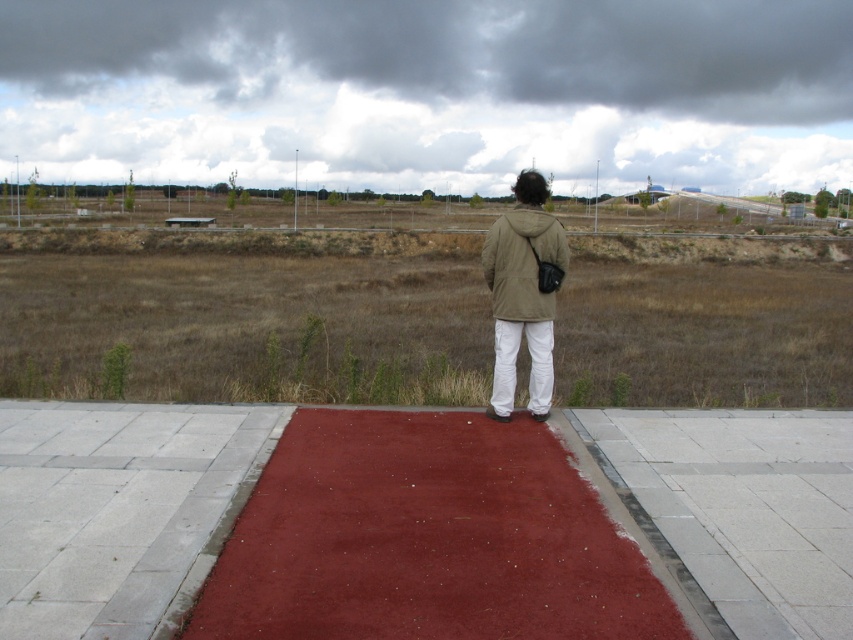
Does rubberized red mat at center have a lesser height compared to khaki matte jacket at center?

Yes.

Does point (331, 428) come closer to viewer compared to point (509, 301)?

No, it is behind (509, 301).

Where is `rubberized red mat at center`? The image size is (853, 640). rubberized red mat at center is located at coordinates (426, 540).

Between gray concrete pavement at center and khaki matte jacket at center, which one has less height?

gray concrete pavement at center

Which is more to the right, gray concrete pavement at center or khaki matte jacket at center?

From the viewer's perspective, gray concrete pavement at center appears more on the right side.

The height and width of the screenshot is (640, 853). Identify the location of gray concrete pavement at center. (744, 508).

Where is `gray concrete pavement at center`? The width and height of the screenshot is (853, 640). gray concrete pavement at center is located at coordinates (744, 508).

Between rubberized red mat at center and gray concrete pavement at center, which one appears on the right side from the viewer's perspective?

gray concrete pavement at center

Is point (579, 563) less distant than point (775, 500)?

Yes, it is in front of point (775, 500).

Find the location of a particular element. rubberized red mat at center is located at coordinates (426, 540).